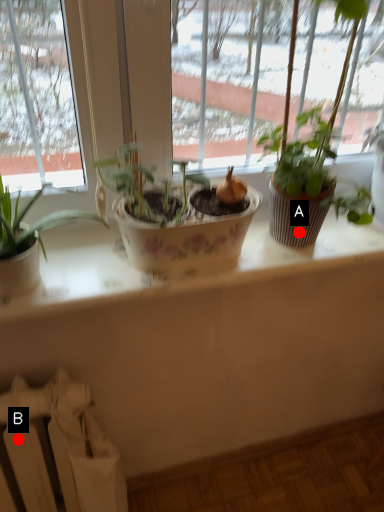
Question: Two points are circled on the image, labeled by A and B beside each circle. Which point appears farthest from the camera in this image?

Choices:
 (A) A is further
 (B) B is further

Answer: (B)